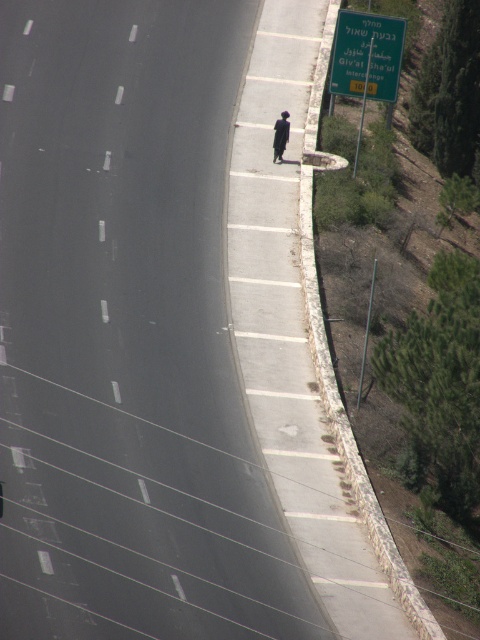
Is point (247, 301) closer to camera compared to point (372, 19)?

Yes, point (247, 301) is in front of point (372, 19).

Does point (287, 371) come in front of point (352, 28)?

Yes.

I want to click on dirt path at right, so (303, 336).

Can you confirm if green plastic sign at upper right is thinner than dark fabric person at right?

No, green plastic sign at upper right is not thinner than dark fabric person at right.

Who is higher up, green plastic sign at upper right or dark fabric person at right?

green plastic sign at upper right

Which is behind, point (361, 29) or point (275, 128)?

The point (361, 29) is more distant.

At what (x,y) coordinates should I click in order to perform the action: click on green plastic sign at upper right. Please return your answer as a coordinate pair (x, y). This screenshot has width=480, height=640. Looking at the image, I should click on (367, 54).

Where is `dirt path at right`? Image resolution: width=480 pixels, height=640 pixels. dirt path at right is located at coordinates (303, 336).

In the scene shown: Can you confirm if dirt path at right is bigger than dark fabric person at right?

Indeed, dirt path at right has a larger size compared to dark fabric person at right.

Identify the location of dirt path at right. This screenshot has height=640, width=480. (303, 336).